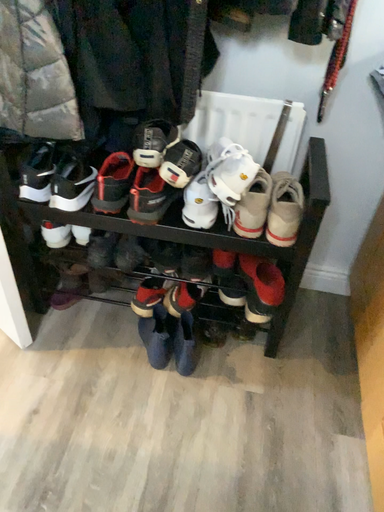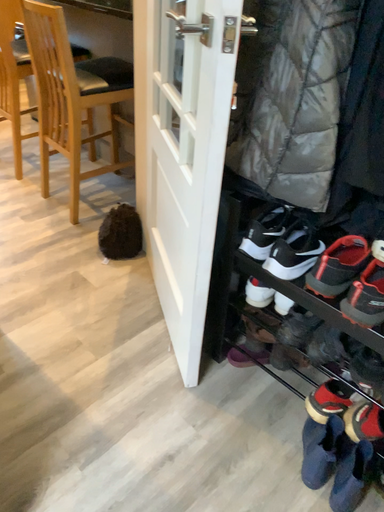
Question: Which way did the camera rotate in the video?

Choices:
 (A) rotated left
 (B) rotated right

Answer: (A)